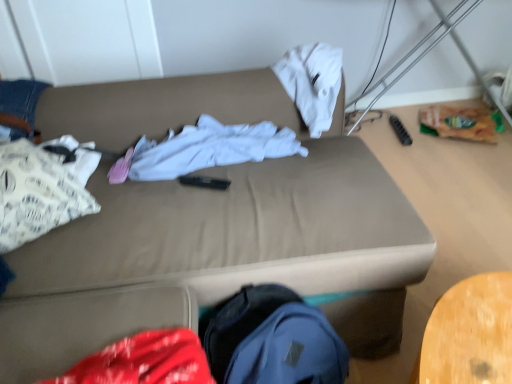
Question: Considering the relative sizes of beige fabric couch at center and white cotton shirt at center, which appears as the first clothing when viewed from the right, in the image provided, is beige fabric couch at center shorter than white cotton shirt at center, which appears as the first clothing when viewed from the right,?

Choices:
 (A) yes
 (B) no

Answer: (B)

Question: Is beige fabric couch at center looking in the opposite direction of white cotton shirt at center, which appears as the first clothing when viewed from the right?

Choices:
 (A) no
 (B) yes

Answer: (B)

Question: From the image's perspective, is beige fabric couch at center beneath white cotton shirt at center, which is the second clothing from left to right?

Choices:
 (A) yes
 (B) no

Answer: (A)

Question: Is white cotton shirt at center, which is the second clothing from left to right, surrounded by beige fabric couch at center?

Choices:
 (A) no
 (B) yes

Answer: (B)

Question: From a real-world perspective, is beige fabric couch at center on white cotton shirt at center, which appears as the first clothing when viewed from the right?

Choices:
 (A) no
 (B) yes

Answer: (A)

Question: Is beige fabric couch at center behind white cotton shirt at center, which appears as the first clothing when viewed from the right?

Choices:
 (A) yes
 (B) no

Answer: (B)

Question: From a real-world perspective, is beige fabric couch at center over white paper bag at left, which is the first clothing in left-to-right order?

Choices:
 (A) yes
 (B) no

Answer: (B)

Question: From a real-world perspective, is beige fabric couch at center beneath white paper bag at left, which is the first clothing in left-to-right order?

Choices:
 (A) no
 (B) yes

Answer: (B)

Question: Are beige fabric couch at center and white paper bag at left, which is the first clothing in left-to-right order, making contact?

Choices:
 (A) yes
 (B) no

Answer: (B)

Question: Is beige fabric couch at center shorter than white paper bag at left, which is the first clothing in left-to-right order?

Choices:
 (A) no
 (B) yes

Answer: (A)

Question: Is beige fabric couch at center smaller than white paper bag at left, which is the first clothing in left-to-right order?

Choices:
 (A) yes
 (B) no

Answer: (B)

Question: Is beige fabric couch at center far from white paper bag at left, which is the first clothing in left-to-right order?

Choices:
 (A) no
 (B) yes

Answer: (A)

Question: From the image's perspective, would you say white cotton shirt at center, which appears as the first clothing when viewed from the right, is shown under white paper bag at left, arranged as the 2th clothing when viewed from the right?

Choices:
 (A) no
 (B) yes

Answer: (A)